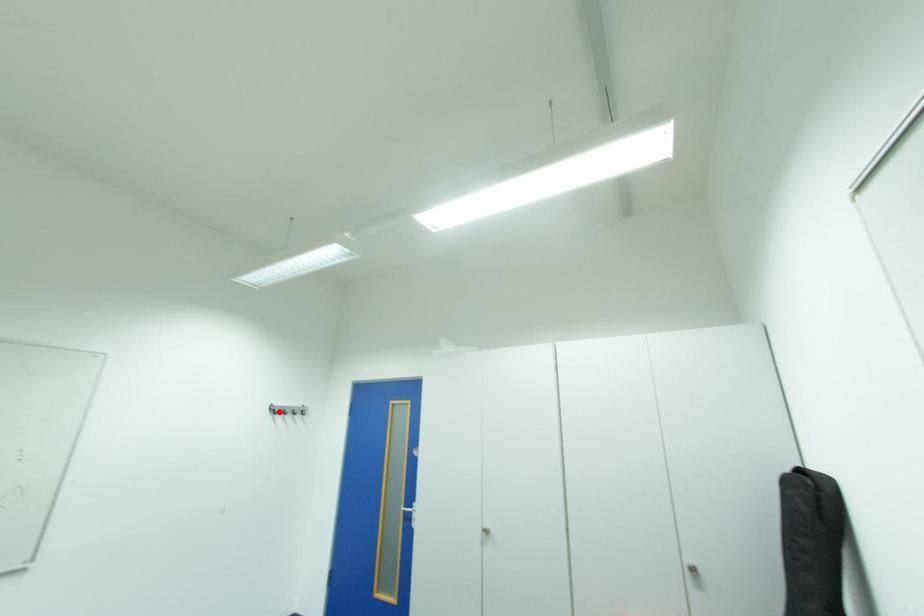
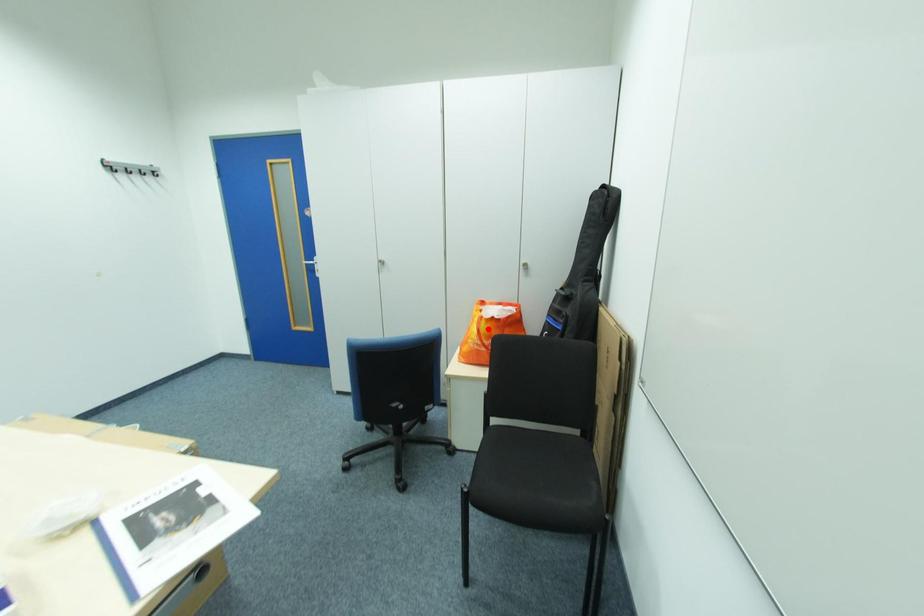
I am providing you with two images of the same scene from different viewpoints. A red point is marked on the first image and another point is marked on the second image. Is the marked point in image1 the same physical position as the marked point in image2?

No